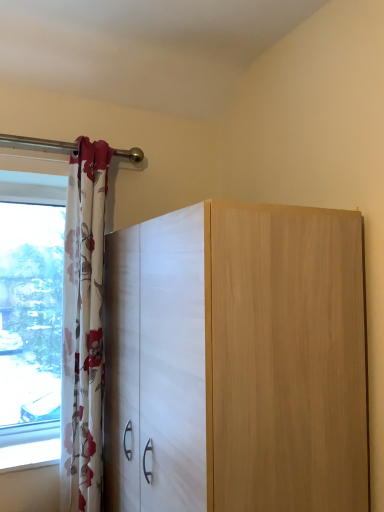
Question: From a real-world perspective, is floral fabric curtain at left physically located above or below matte white cabinet at center?

Choices:
 (A) below
 (B) above

Answer: (B)

Question: In terms of width, does floral fabric curtain at left look wider or thinner when compared to matte white cabinet at center?

Choices:
 (A) wide
 (B) thin

Answer: (B)

Question: Is floral fabric curtain at left bigger or smaller than matte white cabinet at center?

Choices:
 (A) small
 (B) big

Answer: (A)

Question: Is matte white cabinet at center in front of or behind floral fabric curtain at left in the image?

Choices:
 (A) behind
 (B) front

Answer: (B)

Question: Looking at their shapes, would you say matte white cabinet at center is wider or thinner than floral fabric curtain at left?

Choices:
 (A) wide
 (B) thin

Answer: (A)

Question: Would you say matte white cabinet at center is to the left or to the right of floral fabric curtain at left in the picture?

Choices:
 (A) left
 (B) right

Answer: (B)

Question: Is matte white cabinet at center taller or shorter than floral fabric curtain at left?

Choices:
 (A) short
 (B) tall

Answer: (A)